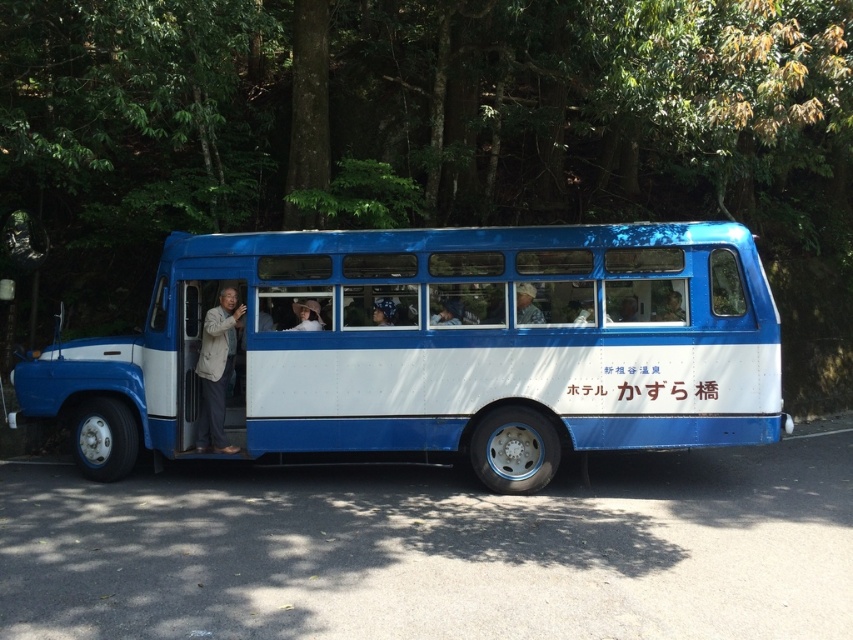
Question: Is blue matte bus at center to the right of beige fabric jacket at left from the viewer's perspective?

Choices:
 (A) no
 (B) yes

Answer: (B)

Question: Which point appears farthest from the camera in this image?

Choices:
 (A) (218, 445)
 (B) (444, 352)

Answer: (A)

Question: Can you confirm if blue matte bus at center is positioned to the right of beige fabric jacket at left?

Choices:
 (A) yes
 (B) no

Answer: (A)

Question: Which of the following is the closest to the observer?

Choices:
 (A) (606, 269)
 (B) (224, 404)

Answer: (A)

Question: Among these points, which one is farthest from the camera?

Choices:
 (A) (563, 396)
 (B) (224, 304)

Answer: (B)

Question: Is blue matte bus at center to the left of beige fabric jacket at left from the viewer's perspective?

Choices:
 (A) no
 (B) yes

Answer: (A)